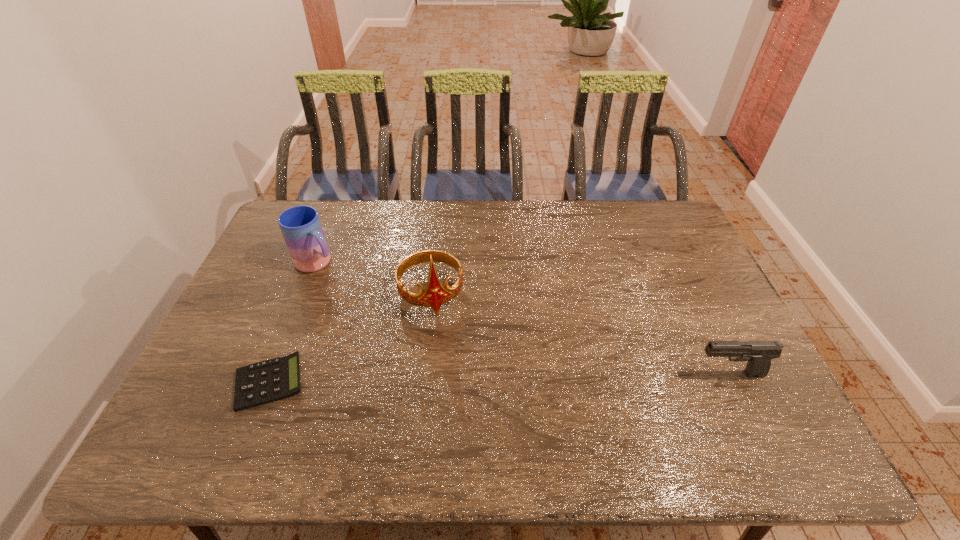
Where is `object present at the near left corner`? object present at the near left corner is located at coordinates (272, 380).

In the image, there is a desktop. Identify the location of free space at the far edge. (501, 205).

The width and height of the screenshot is (960, 540). I want to click on vacant space at the near edge, so click(x=580, y=397).

You are a GUI agent. You are given a task and a screenshot of the screen. Output one action in this format:
    pyautogui.click(x=<x>, y=<y>)
    Task: Click on the vacant region at the left edge of the desktop
    
    Given the screenshot: What is the action you would take?
    pyautogui.click(x=266, y=333)

Identify the location of vacant area at the right edge. The width and height of the screenshot is (960, 540). (669, 291).

This screenshot has width=960, height=540. I want to click on free spot between the mug and the pistol, so click(x=523, y=319).

Find the location of a particular element. This screenshot has height=540, width=960. vacant area that lies between the third tallest object and the shortest object is located at coordinates (499, 379).

Locate an element on the screen. This screenshot has width=960, height=540. free space between the third tallest object and the shortest object is located at coordinates (499, 379).

Image resolution: width=960 pixels, height=540 pixels. Identify the location of free space between the shortest object and the second object from right to left. (350, 338).

Find the location of a particular element. The height and width of the screenshot is (540, 960). free space that is in between the pistol and the shortest object is located at coordinates (499, 379).